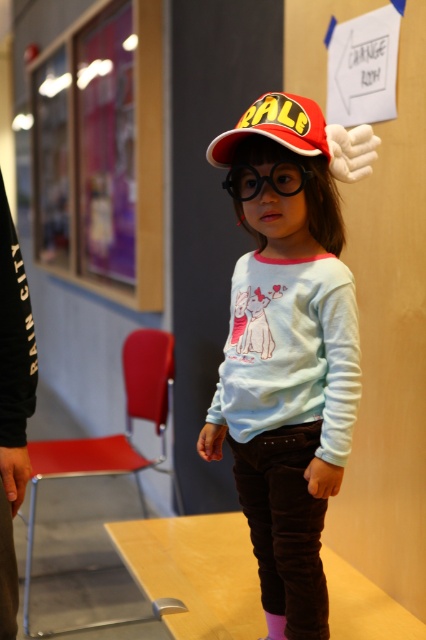
Question: Which is nearer to the red matte baseball cap at center?

Choices:
 (A) black cotton sweatshirt at left
 (B) black plastic goggles at center
 (C) white soft sock at lower center

Answer: (B)

Question: Does matte red cap at center have a smaller size compared to black plastic goggles at center?

Choices:
 (A) no
 (B) yes

Answer: (A)

Question: Can you confirm if black cotton sweatshirt at left is positioned below white soft sock at lower center?

Choices:
 (A) yes
 (B) no

Answer: (B)

Question: Which of the following is the farthest from the observer?

Choices:
 (A) matte red cap at center
 (B) black plastic goggles at center
 (C) white soft sock at lower center

Answer: (C)

Question: Which object is positioned farthest from the red matte baseball cap at center?

Choices:
 (A) white soft sock at lower center
 (B) black cotton sweatshirt at left
 (C) black plastic goggles at center
 (D) matte red cap at center

Answer: (A)

Question: Is black cotton sweatshirt at left smaller than red matte baseball cap at center?

Choices:
 (A) yes
 (B) no

Answer: (A)